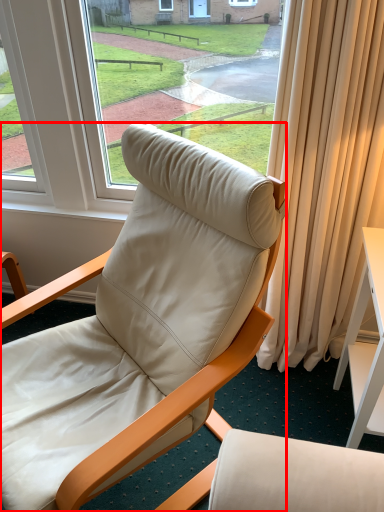
Question: From the image's perspective, what is the correct spatial positioning of chair (annotated by the red box) in reference to desk?

Choices:
 (A) above
 (B) below

Answer: (A)